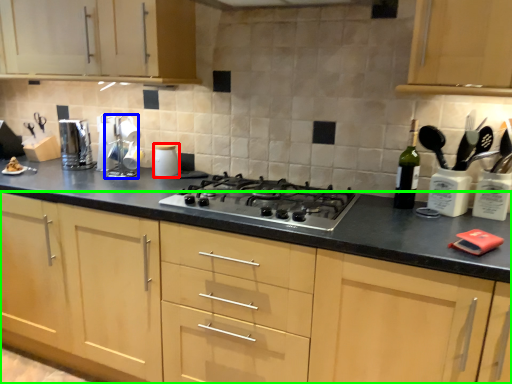
Question: Considering the real-world distances, which object is farthest from kitchen appliance (highlighted by a red box)? appliance (highlighted by a blue box) or cabinetry (highlighted by a green box)?

Choices:
 (A) appliance
 (B) cabinetry

Answer: (B)